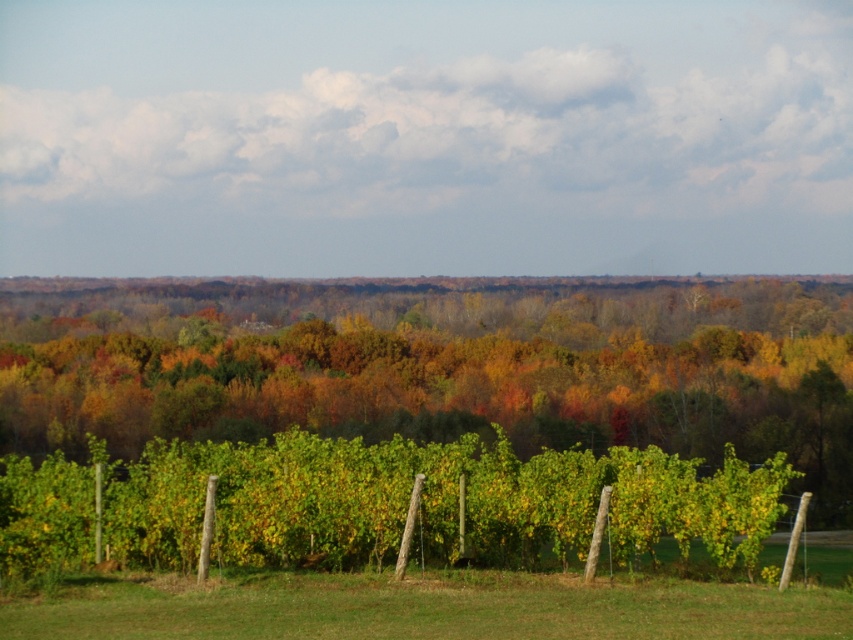
Does green leafy vines at center lie in front of green grass at lower center?

No, green leafy vines at center is behind green grass at lower center.

Who is more distant from viewer, (709, 509) or (276, 589)?

The point (709, 509) is more distant.

Who is more forward, (524,528) or (500,592)?

Point (500,592)

Find the location of a particular element. green leafy vines at center is located at coordinates (428, 502).